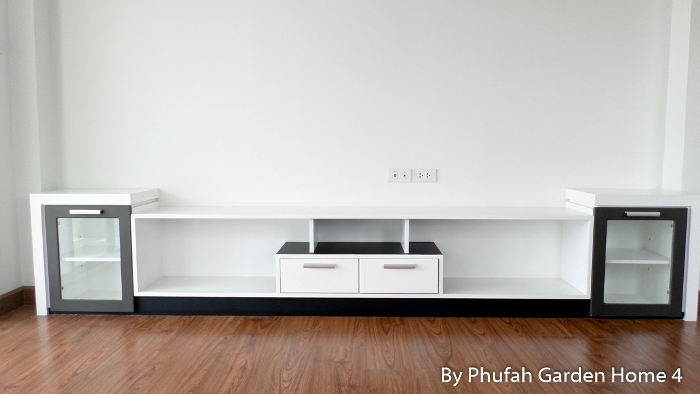
The width and height of the screenshot is (700, 394). I want to click on floor, so click(407, 343).